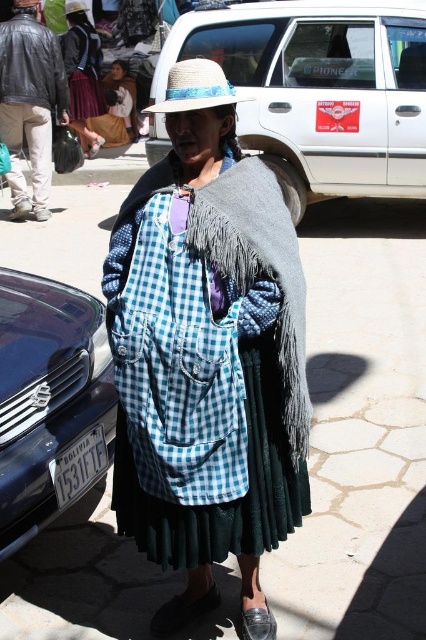
Question: Is blue checkered dress at center smaller than leather at lower center?

Choices:
 (A) yes
 (B) no

Answer: (B)

Question: Which point is farther from the camera taking this photo?

Choices:
 (A) (275, 461)
 (B) (233, 244)
 (C) (48, 317)

Answer: (C)

Question: Which object is farther from the camera taking this photo?

Choices:
 (A) white plastic license plate at lower left
 (B) leather at lower center
 (C) metallic blue car at lower left
 (D) white matte van at upper center

Answer: (D)

Question: Does metallic blue car at lower left appear over leather at lower center?

Choices:
 (A) no
 (B) yes

Answer: (B)

Question: Does fuzzy gray shawl at center appear on the left side of leather at lower center?

Choices:
 (A) yes
 (B) no

Answer: (B)

Question: Which object is farther from the camera taking this photo?

Choices:
 (A) white plastic license plate at lower left
 (B) blue checkered dress at center
 (C) fuzzy gray shawl at center

Answer: (A)